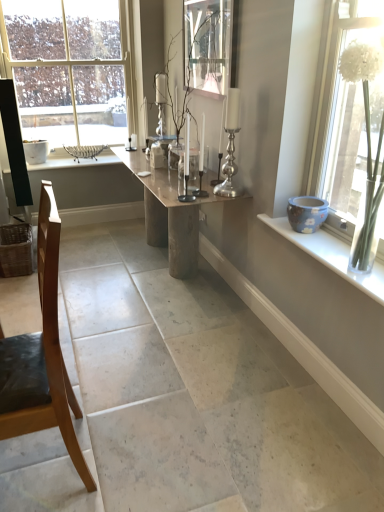
Question: Does silver metallic candle holder at center, the 2th candle holder viewed from the left, lie behind clear glass vase at right, which ranks as the first window in bottom-to-top order?

Choices:
 (A) yes
 (B) no

Answer: (A)

Question: From the image's perspective, is silver metallic candle holder at center, the first candle holder from the right, above clear glass vase at right, which is counted as the 2th window, starting from the left?

Choices:
 (A) no
 (B) yes

Answer: (B)

Question: Is silver metallic candle holder at center, the first candle holder from the right, to the right of clear glass vase at right, which ranks as the first window in front-to-back order, from the viewer's perspective?

Choices:
 (A) yes
 (B) no

Answer: (B)

Question: Considering the relative sizes of silver metallic candle holder at center, the 2th candle holder viewed from the left, and clear glass vase at right, which ranks as the first window in front-to-back order, in the image provided, is silver metallic candle holder at center, the 2th candle holder viewed from the left, wider than clear glass vase at right, which ranks as the first window in front-to-back order,?

Choices:
 (A) yes
 (B) no

Answer: (A)

Question: Considering the relative sizes of silver metallic candle holder at center, the 2th candle holder viewed from the left, and clear glass vase at right, which is the second window in back-to-front order, in the image provided, is silver metallic candle holder at center, the 2th candle holder viewed from the left, smaller than clear glass vase at right, which is the second window in back-to-front order,?

Choices:
 (A) no
 (B) yes

Answer: (B)

Question: In the image, is clear glass candle holder at center, which ranks as the 1th candle holder in left-to-right order, positioned in front of or behind silver metallic candle holder at center, the first candle holder from the right?

Choices:
 (A) behind
 (B) front

Answer: (A)

Question: Is clear glass candle holder at center, which ranks as the 1th candle holder in left-to-right order, wider or thinner than silver metallic candle holder at center, the first candle holder from the right?

Choices:
 (A) thin
 (B) wide

Answer: (A)

Question: Is point (200, 166) positioned closer to the camera than point (231, 94)?

Choices:
 (A) farther
 (B) closer

Answer: (A)

Question: Considering the positions of clear glass candle holder at center, which ranks as the 1th candle holder in left-to-right order, and silver metallic candle holder at center, the 2th candle holder viewed from the left, in the image, is clear glass candle holder at center, which ranks as the 1th candle holder in left-to-right order, bigger or smaller than silver metallic candle holder at center, the 2th candle holder viewed from the left,?

Choices:
 (A) big
 (B) small

Answer: (B)

Question: Based on their positions, is natural wood table at center located to the left or right of clear glass picture frame at upper center?

Choices:
 (A) left
 (B) right

Answer: (A)

Question: From a real-world perspective, is natural wood table at center above or below clear glass picture frame at upper center?

Choices:
 (A) below
 (B) above

Answer: (A)

Question: Is natural wood table at center taller or shorter than clear glass picture frame at upper center?

Choices:
 (A) short
 (B) tall

Answer: (B)

Question: Does point (147, 229) appear closer or farther from the camera than point (233, 52)?

Choices:
 (A) closer
 (B) farther

Answer: (B)

Question: Is clear glass window at upper left, marked as the first window in a top-to-bottom arrangement, situated inside blue ceramic pot at right or outside?

Choices:
 (A) inside
 (B) outside

Answer: (B)

Question: From a real-world perspective, relative to blue ceramic pot at right, is clear glass window at upper left, the 2th window from the bottom, vertically above or below?

Choices:
 (A) below
 (B) above

Answer: (B)